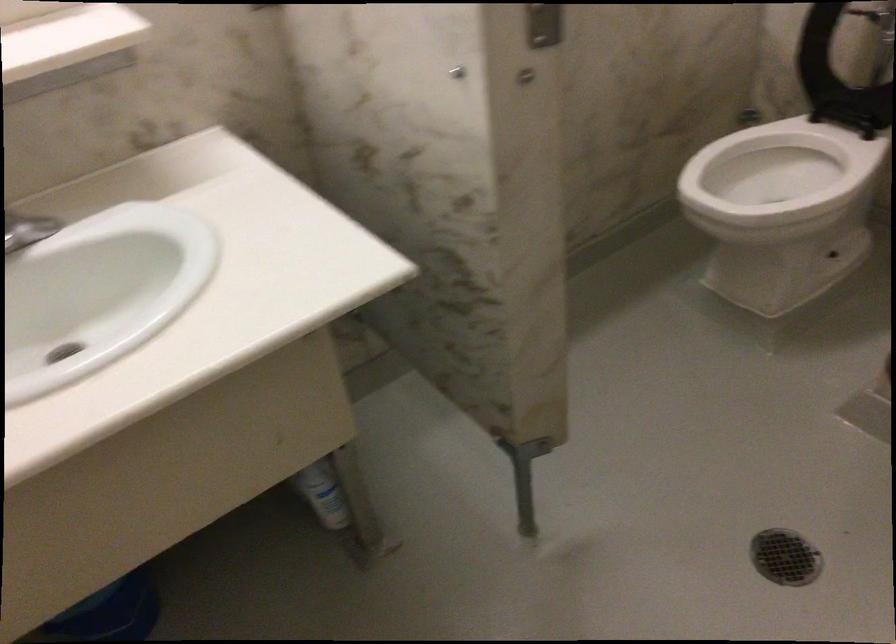
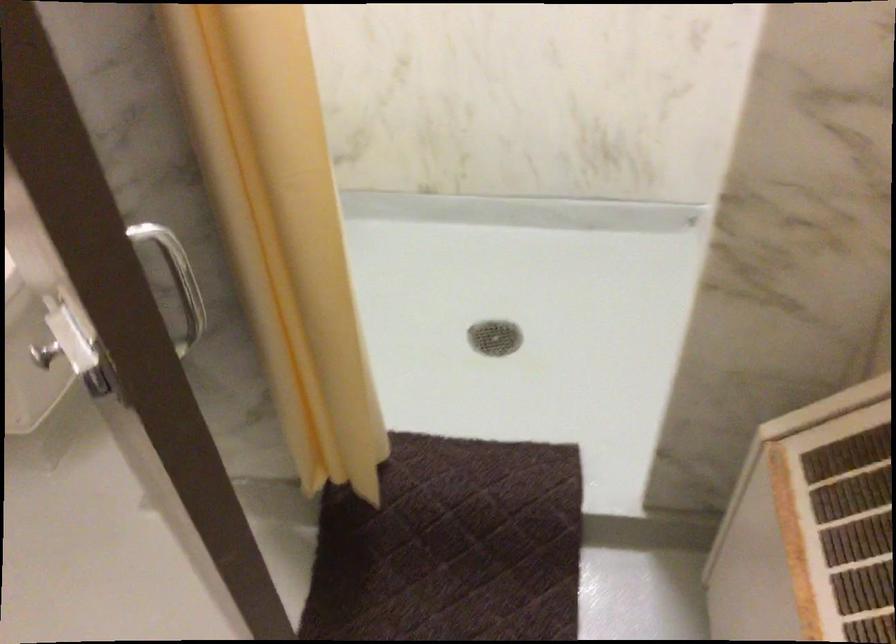
Question: The camera is either moving clockwise (left) or counter-clockwise (right) around the object. The first image is from the beginning of the video and the second image is from the end. Is the camera moving left or right when shooting the video?

Choices:
 (A) Left
 (B) Right

Answer: (A)